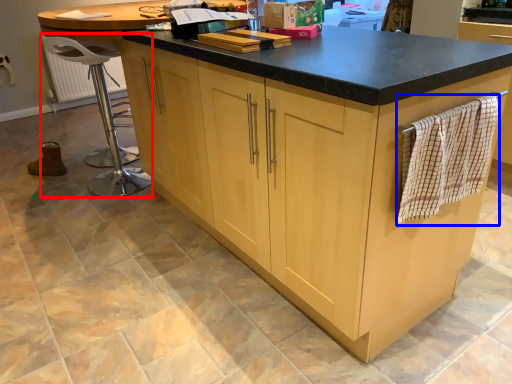
Question: Which object appears closest to the camera in this image, bar stool (highlighted by a red box) or blanket (highlighted by a blue box)?

Choices:
 (A) bar stool
 (B) blanket

Answer: (B)